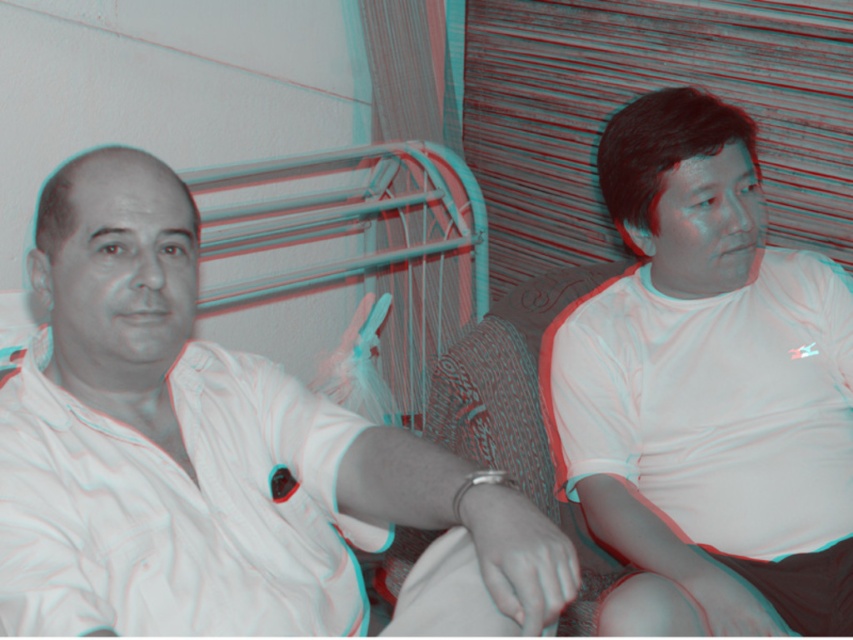
Question: Based on their relative distances, which object is nearer to the white cotton shirt at right?

Choices:
 (A) white matte polo shirt at left
 (B) white matte shirt at left

Answer: (B)

Question: Is white matte shirt at left to the left of white cotton shirt at right from the viewer's perspective?

Choices:
 (A) yes
 (B) no

Answer: (A)

Question: Among these points, which one is nearest to the camera?

Choices:
 (A) (793, 349)
 (B) (108, 324)
 (C) (13, 576)

Answer: (C)

Question: Is white matte shirt at left thinner than white cotton shirt at right?

Choices:
 (A) no
 (B) yes

Answer: (A)

Question: Is white matte shirt at left to the left of white cotton shirt at right from the viewer's perspective?

Choices:
 (A) no
 (B) yes

Answer: (B)

Question: Which point appears farthest from the camera in this image?

Choices:
 (A) (744, 525)
 (B) (33, 392)

Answer: (A)